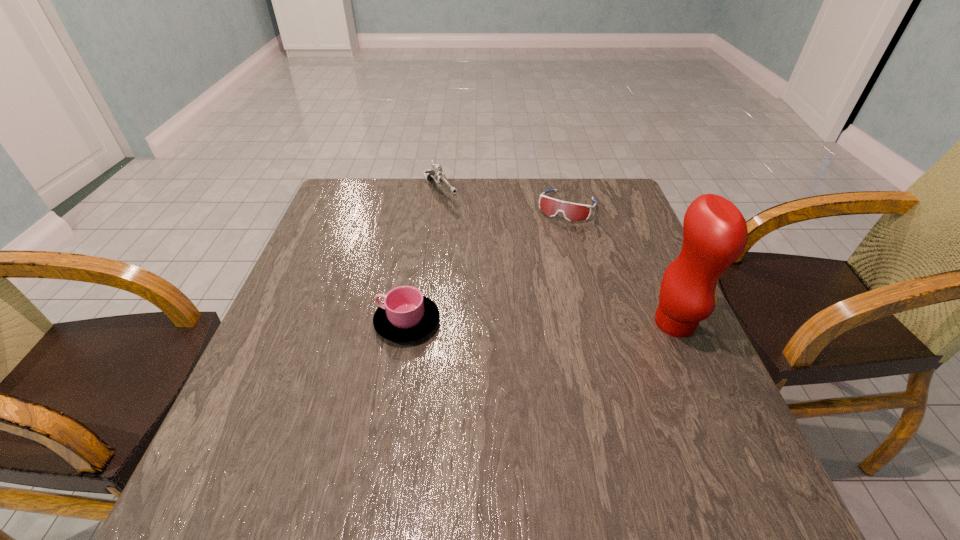
Find the location of `free space on the desktop that is between the cup and the rightmost object and is positioned on the front-facing side of the third object from left to right`. free space on the desktop that is between the cup and the rightmost object and is positioned on the front-facing side of the third object from left to right is located at coordinates (504, 322).

The width and height of the screenshot is (960, 540). I want to click on vacant spot on the desktop that is between the cup and the condiment and is positioned aimed along the barrel of the gun, so click(551, 322).